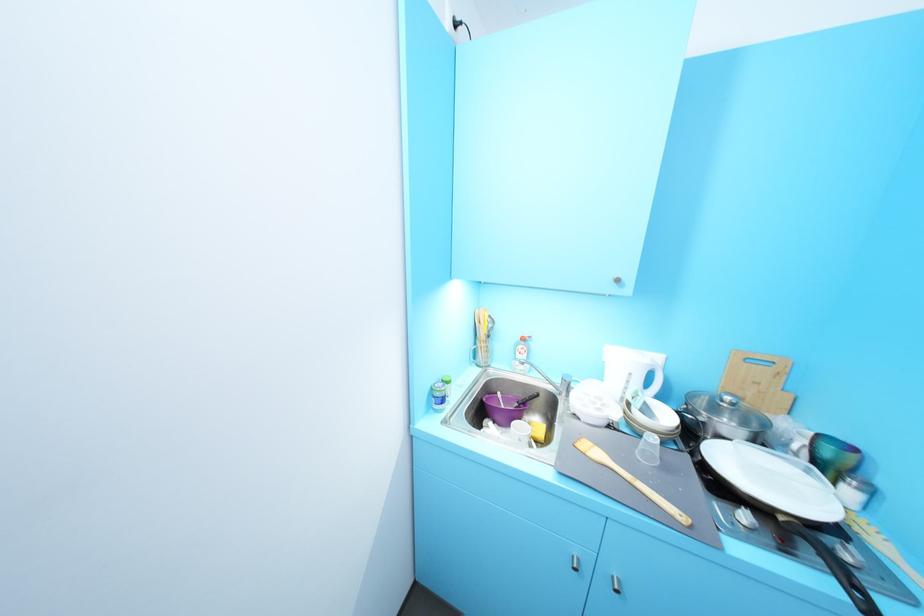
This screenshot has height=616, width=924. What do you see at coordinates (728, 400) in the screenshot?
I see `a pot lid handle` at bounding box center [728, 400].